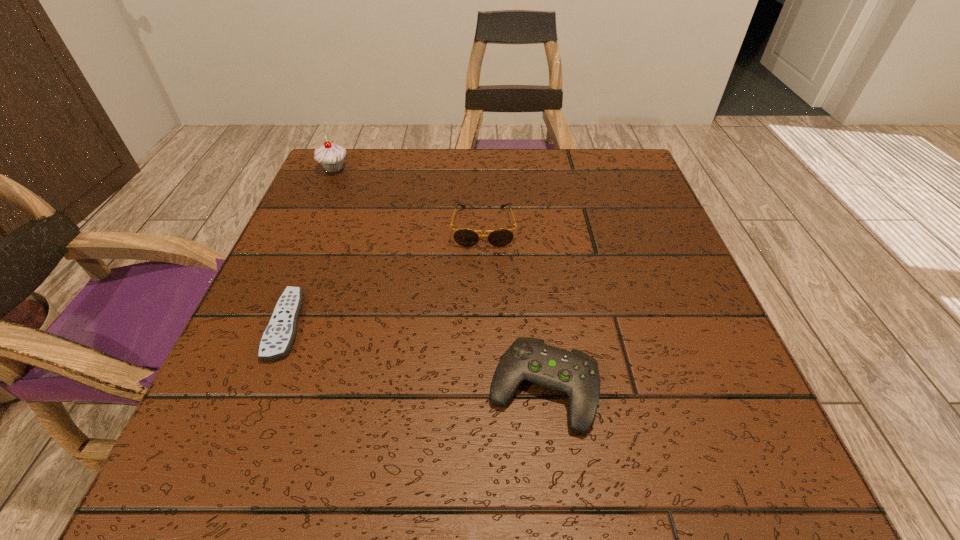
Image resolution: width=960 pixels, height=540 pixels. Identify the location of object that is at the near edge. (574, 373).

The image size is (960, 540). I want to click on cupcake that is at the left edge, so click(331, 156).

I want to click on remote control located in the left edge section of the desktop, so (x=277, y=339).

Locate an element on the screen. The height and width of the screenshot is (540, 960). object that is at the far left corner is located at coordinates (331, 156).

Identify the location of vacant area at the far edge. (564, 166).

Where is `vacant space at the near edge of the desktop`? Image resolution: width=960 pixels, height=540 pixels. vacant space at the near edge of the desktop is located at coordinates (378, 483).

This screenshot has height=540, width=960. In order to click on vacant space at the left edge of the desktop in this screenshot , I will do `click(305, 353)`.

In the image, there is a desktop. Identify the location of vacant space at the right edge. (740, 405).

Find the location of a particular element. This screenshot has width=960, height=540. vacant space at the far left corner is located at coordinates pos(348,197).

This screenshot has width=960, height=540. Identify the location of free region at the near left corner of the desktop. (198, 473).